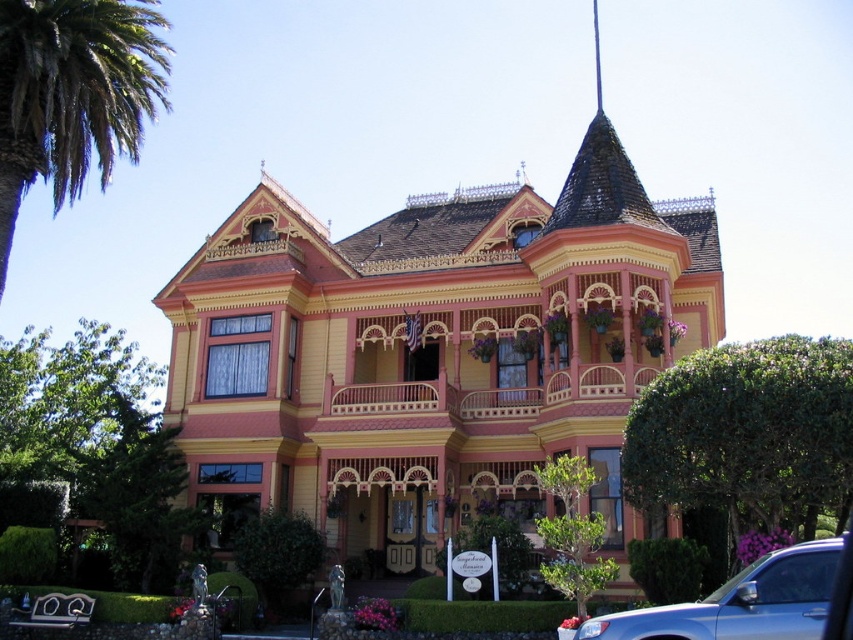
You are standing in front of the Victorian house and want to take a photo that includes both the green leafy palm at upper left and the blue metallic car at lower right. Which object should you position closer to the center of the frame to ensure both are fully visible?

The green leafy palm at upper left is much taller than the blue metallic car at lower right. To ensure both are fully visible, position the taller green leafy palm at upper left closer to the center of the frame so its full height can be captured without cropping.

You are standing in front of the Victorian house and want to take a photo that includes both the green leafy palm at upper left and the blue metallic car at lower right. Which object should you position higher in your camera frame?

The green leafy palm at upper left should be positioned higher in the camera frame since it is located above the blue metallic car at lower right.